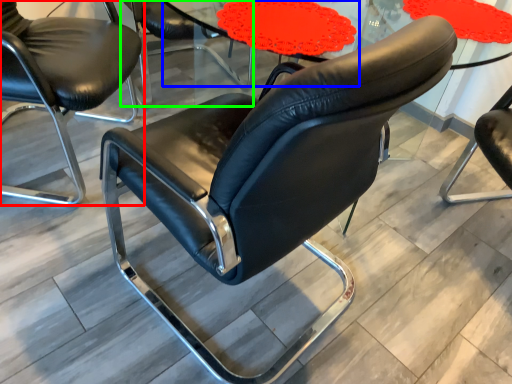
Question: Which object is the farthest from chair (highlighted by a red box)? Choose among these: round table (highlighted by a blue box) or chair (highlighted by a green box).

Choices:
 (A) round table
 (B) chair

Answer: (A)